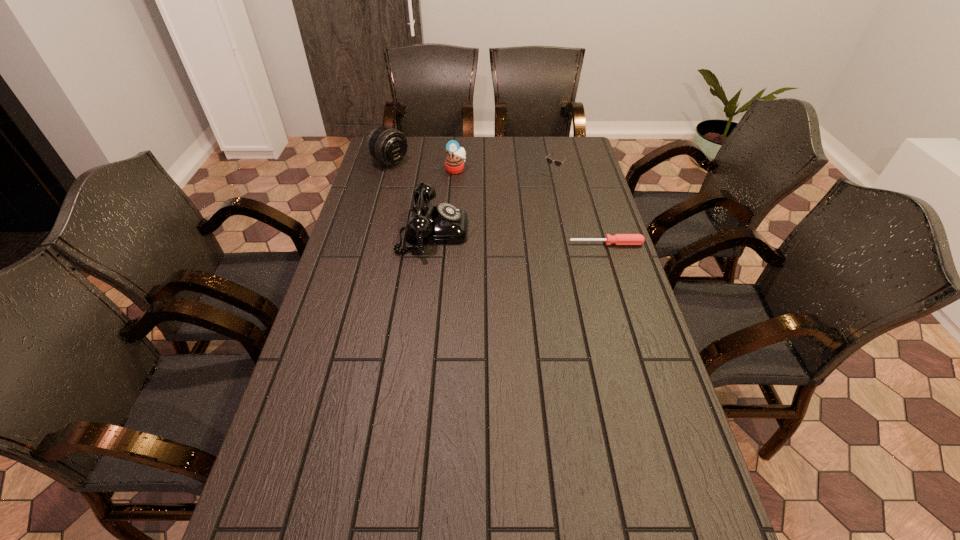
At what (x,y) coordinates should I click in order to perform the action: click on free space on the desktop that is between the telephone and the screwdriver and is positioned on the front-facing side of the muffin. Please return your answer as a coordinate pair (x, y). The width and height of the screenshot is (960, 540). Looking at the image, I should click on (525, 238).

Where is `vacant space on the desktop that is between the telephone and the shortest object and is positioned in front of the lenses of the sunglasses`? The image size is (960, 540). vacant space on the desktop that is between the telephone and the shortest object and is positioned in front of the lenses of the sunglasses is located at coordinates (493, 235).

This screenshot has width=960, height=540. I want to click on vacant space on the desktop that is between the telephone and the screwdriver and is positioned on the front-facing side of the leftmost object, so click(x=527, y=238).